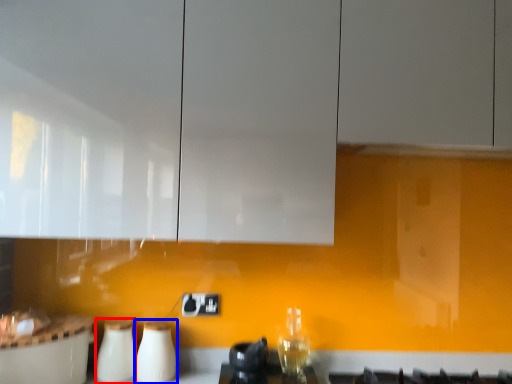
Question: Which of the following is the closest to the observer, appliance (highlighted by a red box) or appliance (highlighted by a blue box)?

Choices:
 (A) appliance
 (B) appliance

Answer: (A)